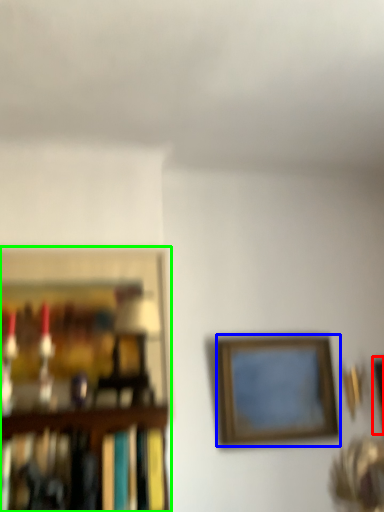
Question: Estimate the real-world distances between objects in this image. Which object is farther from picture frame (highlighted by a red box), picture frame (highlighted by a blue box) or picture frame (highlighted by a green box)?

Choices:
 (A) picture frame
 (B) picture frame

Answer: (B)